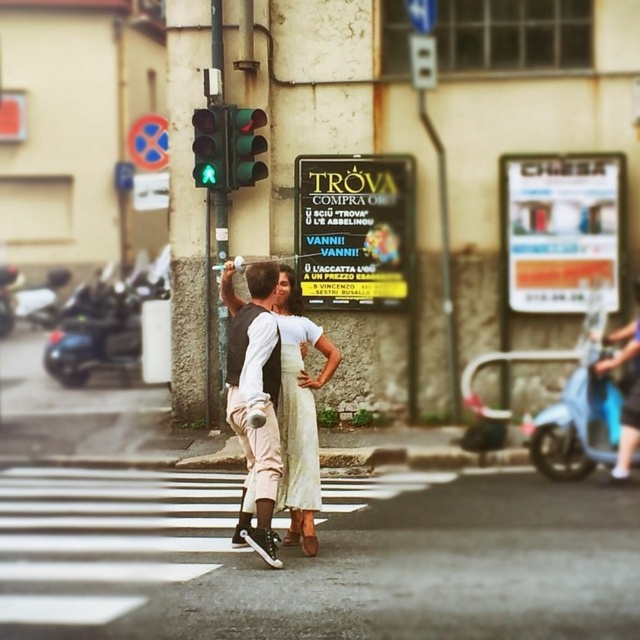
Question: Is green glass traffic light at upper center to the left of metallic pole at center from the viewer's perspective?

Choices:
 (A) yes
 (B) no

Answer: (B)

Question: Can you confirm if metallic pole at center is smaller than green glass pedestrian signal at upper center?

Choices:
 (A) no
 (B) yes

Answer: (B)

Question: Which object appears closest to the camera in this image?

Choices:
 (A) green glass pedestrian signal at upper center
 (B) metallic pole at center

Answer: (A)

Question: Which object is positioned farthest from the metallic pole at center?

Choices:
 (A) green glass pedestrian signal at upper center
 (B) green glass traffic light at upper center
 (C) light beige fabric dress at center
 (D) matte black vest at center

Answer: (D)

Question: Is green glass traffic light at upper center closer to camera compared to metallic pole at center?

Choices:
 (A) yes
 (B) no

Answer: (A)

Question: Estimate the real-world distances between objects in this image. Which object is farther from the metallic pole at center?

Choices:
 (A) green glass pedestrian signal at upper center
 (B) matte black vest at center

Answer: (B)